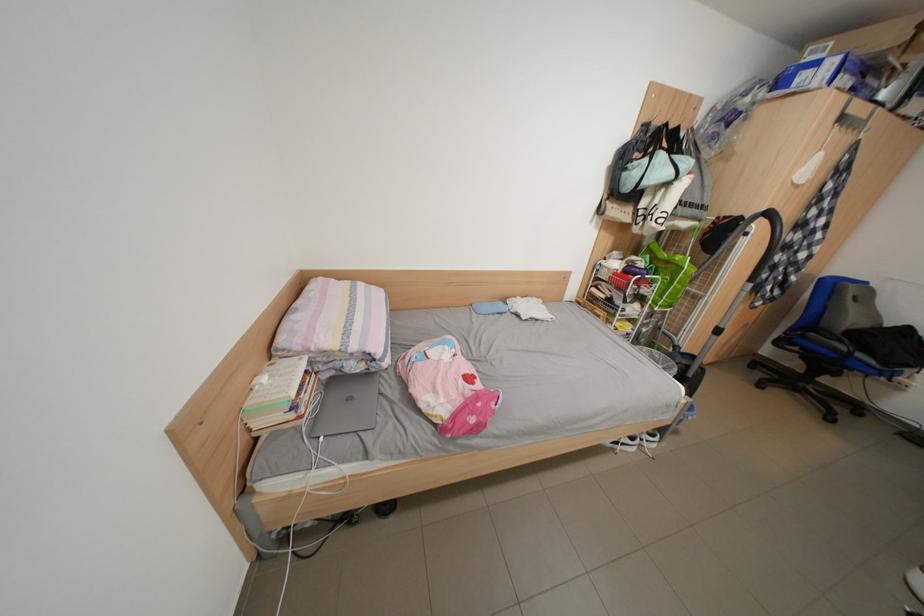
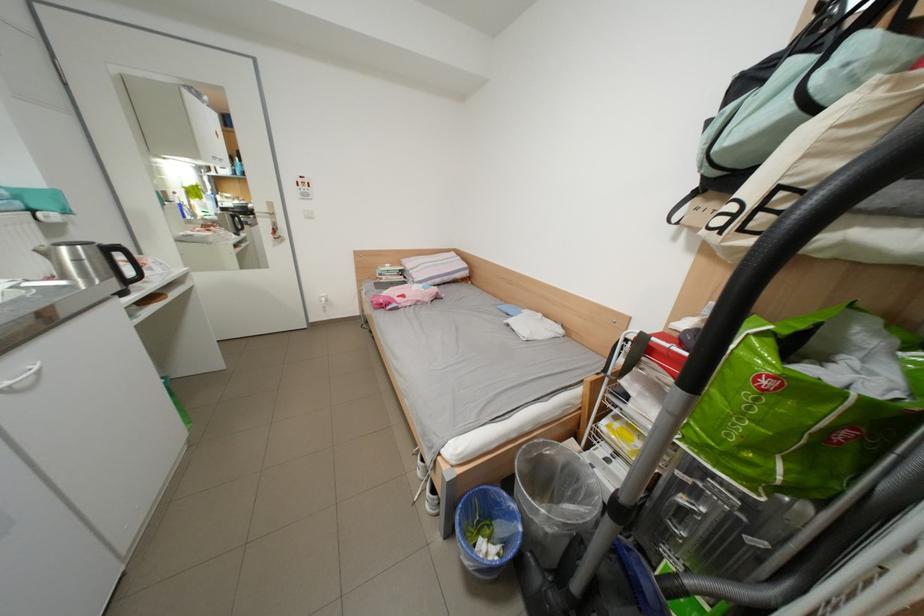
Where in the second image is the point corresponding to [685,177] from the first image?

(801, 111)